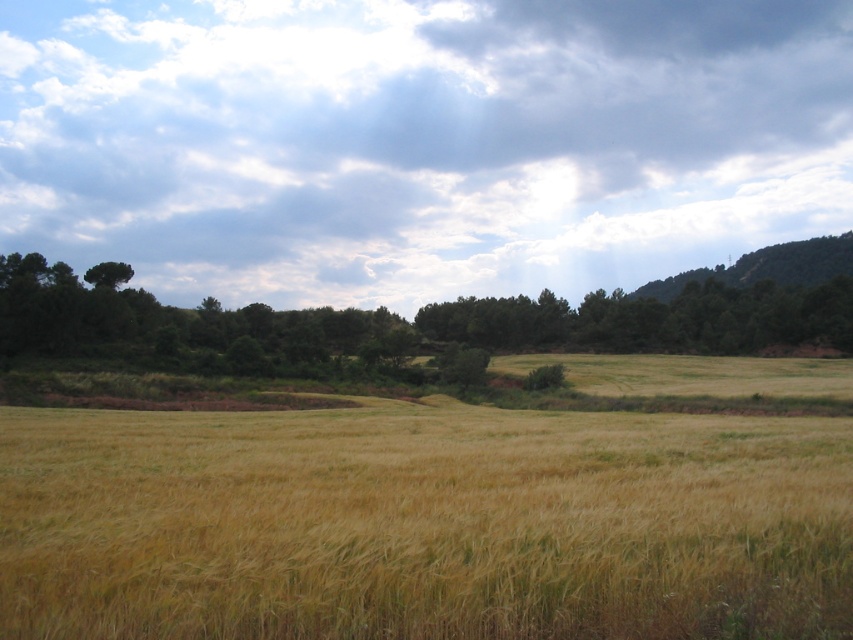
You are an agricultural drone operator planning to survey the cloudy sky at upper center and the golden grassy field at center. Which area requires a wider camera angle to capture fully?

The cloudy sky at upper center requires a wider camera angle because it is larger in size than the golden grassy field at center.

You are standing in the wheat field and looking towards the horizon. Which object, the cloudy sky at upper center or the green leafy tree at upper left, is positioned higher in the scene?

The cloudy sky at upper center is positioned higher than the green leafy tree at upper left because it is described as being above it.